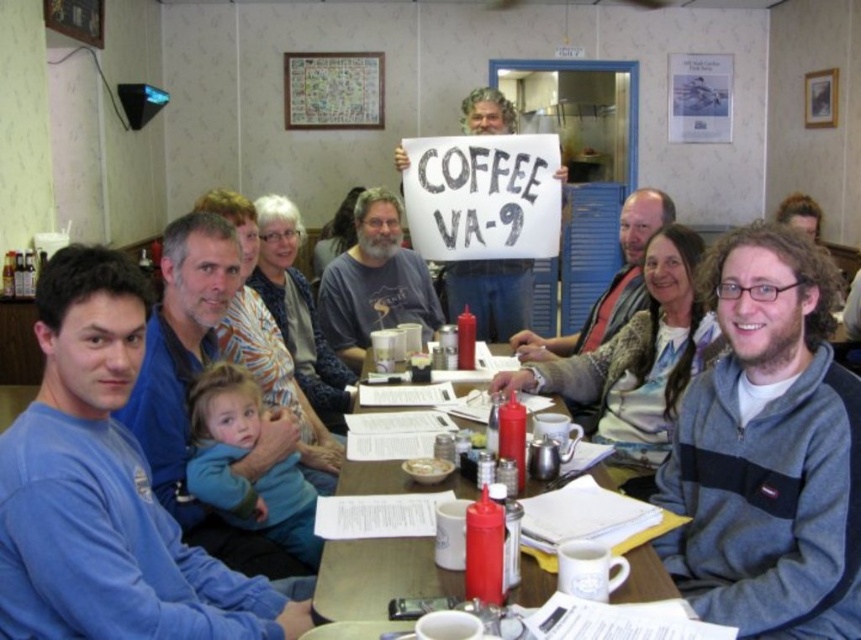
You are a guest at this gathering and want to place a small gift on the table without disturbing the existing items. Since the wooden table at center and the white matte bowl at center are both present, where should you place the gift to ensure it stays on the table?

The wooden table at center is to the right of white matte bowl at center. Therefore, placing the gift to the right of the white matte bowl at center would keep it on the wooden table at center without disturbing the existing items.

You are a server in a cafe who needs to place a white matte bowl at center on the wooden table at center. The bowl is 8 inches in diameter. Can you fit it on the table without overlapping any existing items?

The distance between the wooden table at center and the white matte bowl at center is 8.91 inches. Since the bowl is 8 inches in diameter, there is enough space to place it on the table without overlapping existing items.